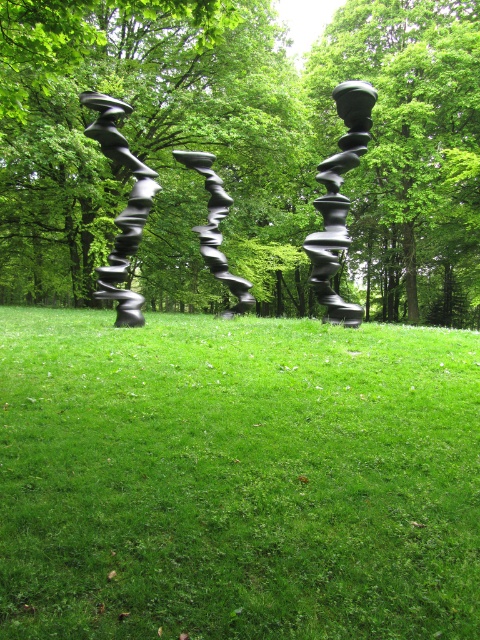
Question: Which of the following is the farthest from the observer?

Choices:
 (A) (337, 35)
 (B) (224, 196)
 (C) (333, 241)
 (D) (143, 518)

Answer: (A)

Question: Can you confirm if green leafy tree at center is positioned to the left of polished black spiral at left?

Choices:
 (A) no
 (B) yes

Answer: (A)

Question: Which point appears closest to the camera in this image?

Choices:
 (A) (387, 156)
 (B) (229, 312)
 (C) (429, 125)
 (D) (330, 177)

Answer: (D)

Question: Does green leafy tree at center have a lesser width compared to green matte tree at center?

Choices:
 (A) no
 (B) yes

Answer: (A)

Question: Is polished black sculpture at center in front of polished black spiral at left?

Choices:
 (A) yes
 (B) no

Answer: (A)

Question: Which of the following is the farthest from the observer?

Choices:
 (A) coord(193,228)
 (B) coord(286,170)
 (C) coord(106,296)

Answer: (B)